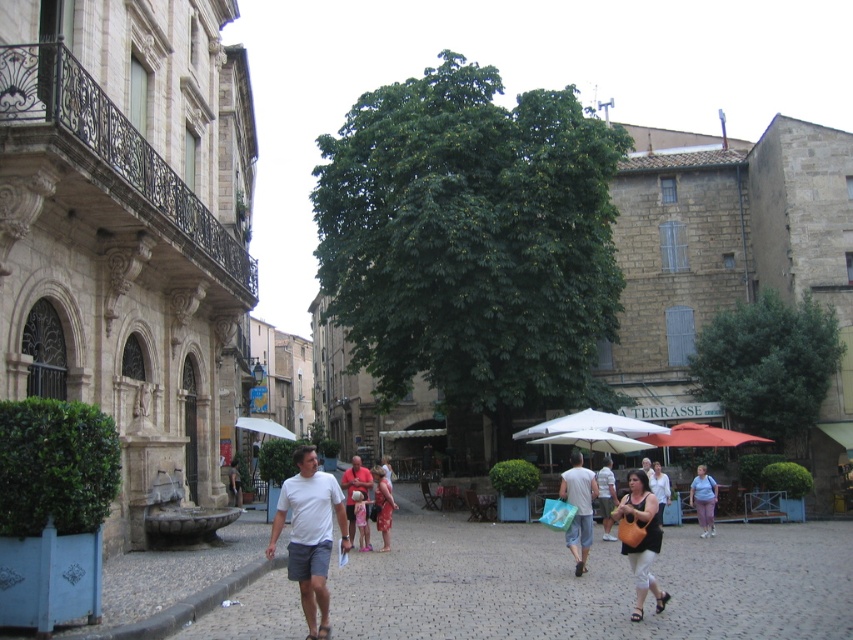
Based on the photo, you are a street performer in the square and need to decide where to place your equipment. The black leather handbag at center and the light purple fabric dress at center are in your way. Which object takes up more space and should be moved first?

The black leather handbag at center is larger in size than the light purple fabric dress at center, so it takes up more space and should be moved first.

You are a fashion designer observing a person wearing both the light purple fabric dress at center and the light brown leather jacket at center. Which clothing item would you recommend removing to ensure the outfit is more streamlined?

The light purple fabric dress at center is bigger than the light brown leather jacket at center. To create a more streamlined look, it would be better to remove the light purple fabric dress at center since it is larger and might overwhelm the outfit.

Consider the image. You are standing in the urban square and want to walk from the point at coordinates point [706,513] to the point at coordinates point [234,500]. According to the scene description, which direction should you move relative to the grand building on the left?

You should move towards the grand building on the left because point [706,513] is in front of point [234,500], meaning the destination is behind the grand building on the left. However, based on the spatial relationship described, moving towards the left side where the grand building is located would align with reaching the point behind it.